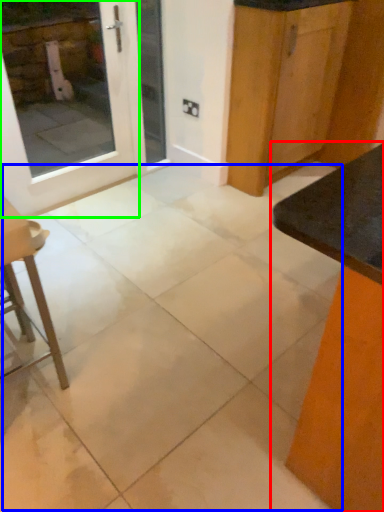
Question: Based on their relative distances, which object is farther from table (highlighted by a red box)? Choose from concrete (highlighted by a blue box) and door (highlighted by a green box).

Choices:
 (A) concrete
 (B) door

Answer: (B)